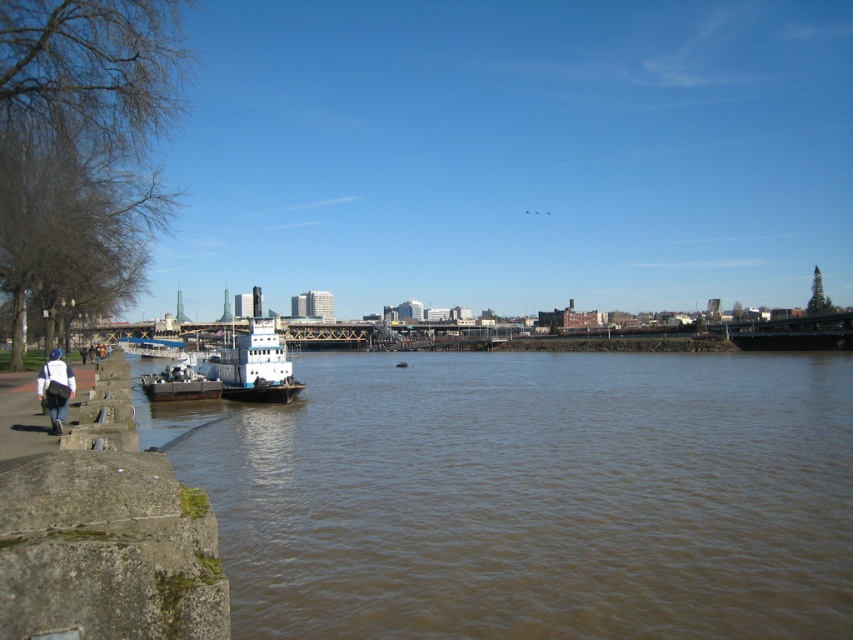
Is white matte tugboat at center positioned at the back of white matte jacket at lower left?

That is True.

Which is behind, point (277, 353) or point (41, 371)?

The point (277, 353) is more distant.

You are a GUI agent. You are given a task and a screenshot of the screen. Output one action in this format:
    pyautogui.click(x=<x>, y=<y>)
    Task: Click on the white matte tugboat at center
    The height and width of the screenshot is (640, 853).
    Given the screenshot: What is the action you would take?
    pyautogui.click(x=254, y=365)

Does point (239, 336) lie behind point (166, 376)?

That is True.

Consider the image. Which is more to the left, white matte tugboat at center or matte white barge at left?

matte white barge at left is more to the left.

At what (x,y) coordinates should I click in order to perform the action: click on white matte tugboat at center. Please return your answer as a coordinate pair (x, y). The width and height of the screenshot is (853, 640). Looking at the image, I should click on (254, 365).

Which is more to the right, matte white barge at left or white matte jacket at lower left?

From the viewer's perspective, white matte jacket at lower left appears more on the right side.

Between point (189, 385) and point (65, 396), which one is positioned behind?

The point (189, 385) is more distant.

Measure the distance between point (x=160, y=387) and camera.

Point (x=160, y=387) is 54.19 meters away from camera.

At what (x,y) coordinates should I click in order to perform the action: click on matte white barge at left. Please return your answer as a coordinate pair (x, y). Looking at the image, I should click on (178, 384).